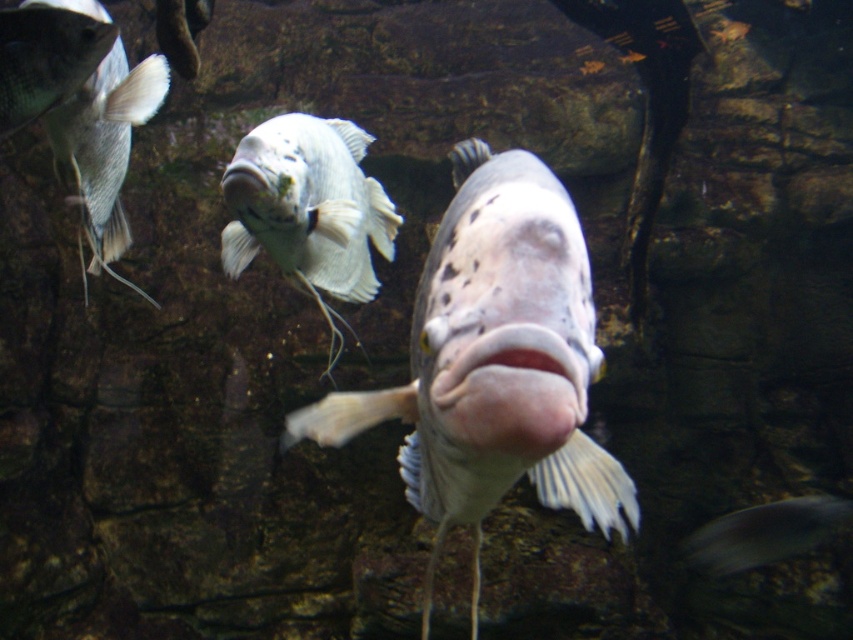
Question: Which of the following is the closest to the observer?

Choices:
 (A) shiny blue fish at upper left
 (B) speckled white fish at center
 (C) white matte fish at center
 (D) silvery metallic fish at lower right

Answer: (B)

Question: Does speckled white fish at center appear on the right side of matte white fish at upper left?

Choices:
 (A) no
 (B) yes

Answer: (B)

Question: Which point appears farthest from the camera in this image?

Choices:
 (A) (48, 1)
 (B) (770, 557)
 (C) (1, 120)
 (D) (334, 339)

Answer: (B)

Question: Is matte white fish at upper left wider than shiny blue fish at upper left?

Choices:
 (A) no
 (B) yes

Answer: (B)

Question: Can you confirm if speckled white fish at center is bigger than matte white fish at upper left?

Choices:
 (A) yes
 (B) no

Answer: (B)

Question: Which of the following is the farthest from the observer?

Choices:
 (A) (579, 392)
 (B) (746, 541)
 (C) (86, 12)
 (D) (20, 99)

Answer: (B)